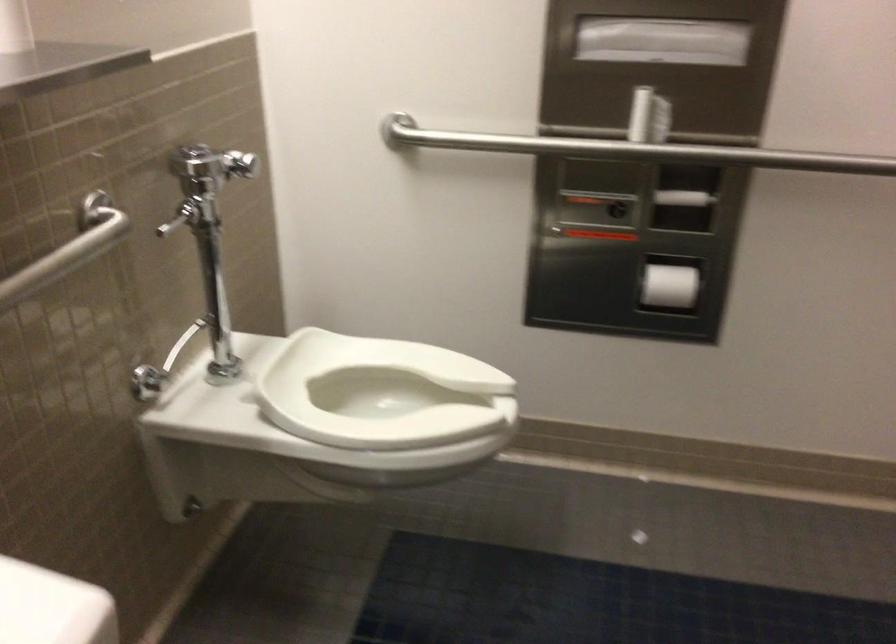
The width and height of the screenshot is (896, 644). I want to click on dispenser turn knob, so click(x=147, y=383).